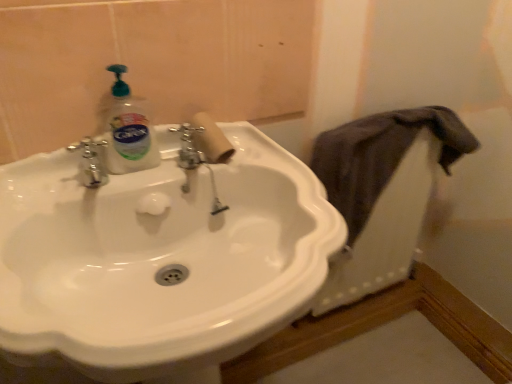
Question: Is point (132, 372) closer or farther from the camera than point (192, 119)?

Choices:
 (A) closer
 (B) farther

Answer: (A)

Question: In the image, is white glossy sink at center positioned in front of or behind white cardboard toilet paper at center?

Choices:
 (A) behind
 (B) front

Answer: (B)

Question: Estimate the real-world distances between objects in this image. Which object is farther from the dark gray fabric at right?

Choices:
 (A) white glossy sink at center
 (B) clear plastic bottle at upper left
 (C) white cardboard toilet paper at center

Answer: (B)

Question: Based on their relative distances, which object is nearer to the dark gray fabric at right?

Choices:
 (A) white glossy sink at center
 (B) white cardboard toilet paper at center
 (C) clear plastic bottle at upper left

Answer: (A)